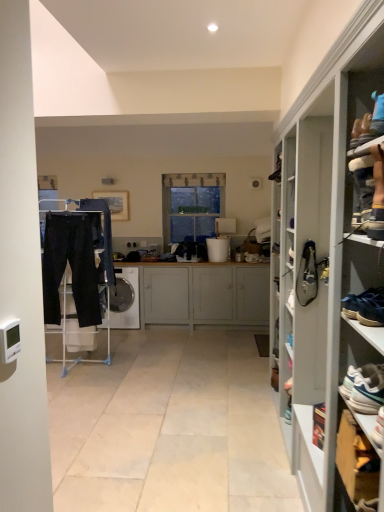
Question: Is white glossy dishwasher at center further to the viewer compared to wooden cabinet at lower right?

Choices:
 (A) yes
 (B) no

Answer: (A)

Question: Would you say wooden cabinet at lower right is part of white glossy dishwasher at center's contents?

Choices:
 (A) yes
 (B) no

Answer: (B)

Question: Can you confirm if white glossy dishwasher at center is thinner than wooden cabinet at lower right?

Choices:
 (A) yes
 (B) no

Answer: (B)

Question: Can you confirm if white glossy dishwasher at center is taller than wooden cabinet at lower right?

Choices:
 (A) no
 (B) yes

Answer: (B)

Question: Considering the relative positions of white glossy dishwasher at center and wooden cabinet at lower right in the image provided, is white glossy dishwasher at center to the left of wooden cabinet at lower right from the viewer's perspective?

Choices:
 (A) yes
 (B) no

Answer: (A)

Question: Is black cotton trousers at left in front of or behind wooden cabinet at lower right in the image?

Choices:
 (A) behind
 (B) front

Answer: (A)

Question: Is point (69, 256) closer or farther from the camera than point (337, 472)?

Choices:
 (A) closer
 (B) farther

Answer: (B)

Question: From the image's perspective, relative to wooden cabinet at lower right, is black cotton trousers at left above or below?

Choices:
 (A) above
 (B) below

Answer: (A)

Question: Based on their positions, is black cotton trousers at left located to the left or right of wooden cabinet at lower right?

Choices:
 (A) left
 (B) right

Answer: (A)

Question: Looking at the image, does wooden cabinet at lower right seem bigger or smaller compared to black leather shoe at right, which appears as the 2th shoe when viewed from the front?

Choices:
 (A) small
 (B) big

Answer: (B)

Question: Considering the positions of wooden cabinet at lower right and black leather shoe at right, which appears as the 2th shoe when viewed from the front, in the image, is wooden cabinet at lower right taller or shorter than black leather shoe at right, which appears as the 2th shoe when viewed from the front,?

Choices:
 (A) tall
 (B) short

Answer: (B)

Question: Is wooden cabinet at lower right in front of or behind black leather shoe at right, marked as the first shoe in a back-to-front arrangement, in the image?

Choices:
 (A) front
 (B) behind

Answer: (A)

Question: Would you say wooden cabinet at lower right is to the left or to the right of black leather shoe at right, which appears as the 2th shoe when viewed from the front, in the picture?

Choices:
 (A) left
 (B) right

Answer: (A)

Question: Considering the positions of white glossy trash can at center and black leather shoe at right, acting as the first shoe starting from the top, in the image, is white glossy trash can at center taller or shorter than black leather shoe at right, acting as the first shoe starting from the top,?

Choices:
 (A) short
 (B) tall

Answer: (B)

Question: From the image's perspective, is white glossy trash can at center located above or below black leather shoe at right, acting as the first shoe starting from the top?

Choices:
 (A) below
 (B) above

Answer: (B)